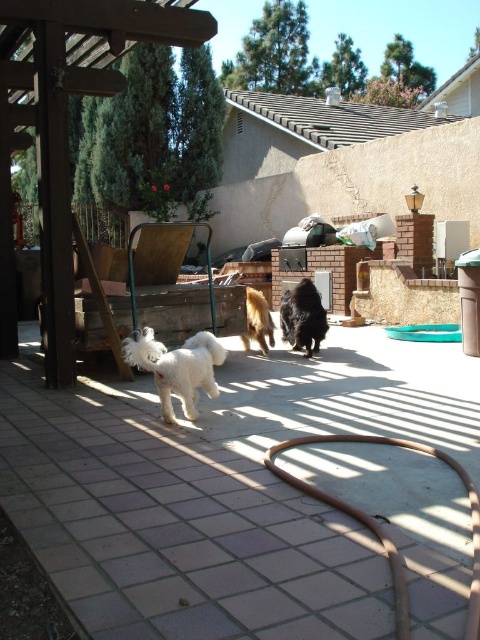
Question: Among these objects, which one is nearest to the camera?

Choices:
 (A) golden fur dog at center
 (B) white fluffy dog at center
 (C) black fuzzy dog at center

Answer: (B)

Question: Which object is the farthest from the golden fur dog at center?

Choices:
 (A) black fuzzy dog at center
 (B) white fluffy dog at center

Answer: (B)

Question: Where is black fuzzy dog at center located in relation to golden fur dog at center in the image?

Choices:
 (A) below
 (B) above

Answer: (A)

Question: In this image, where is white fluffy dog at center located relative to golden fur dog at center?

Choices:
 (A) above
 (B) below

Answer: (B)

Question: Which object is positioned farthest from the white fluffy dog at center?

Choices:
 (A) black fuzzy dog at center
 (B) golden fur dog at center

Answer: (A)

Question: Can you confirm if white fluffy dog at center is smaller than golden fur dog at center?

Choices:
 (A) yes
 (B) no

Answer: (B)